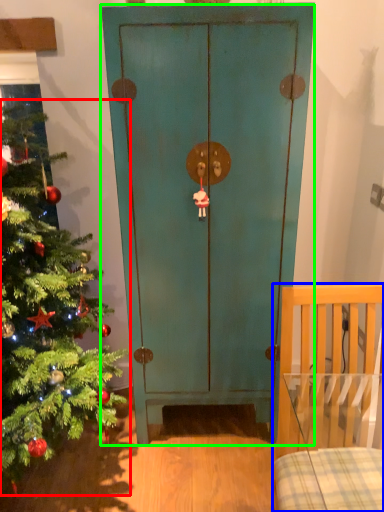
Question: Considering the real-world distances, which object is closest to christmas tree (highlighted by a red box)? furniture (highlighted by a blue box) or door (highlighted by a green box).

Choices:
 (A) furniture
 (B) door

Answer: (B)